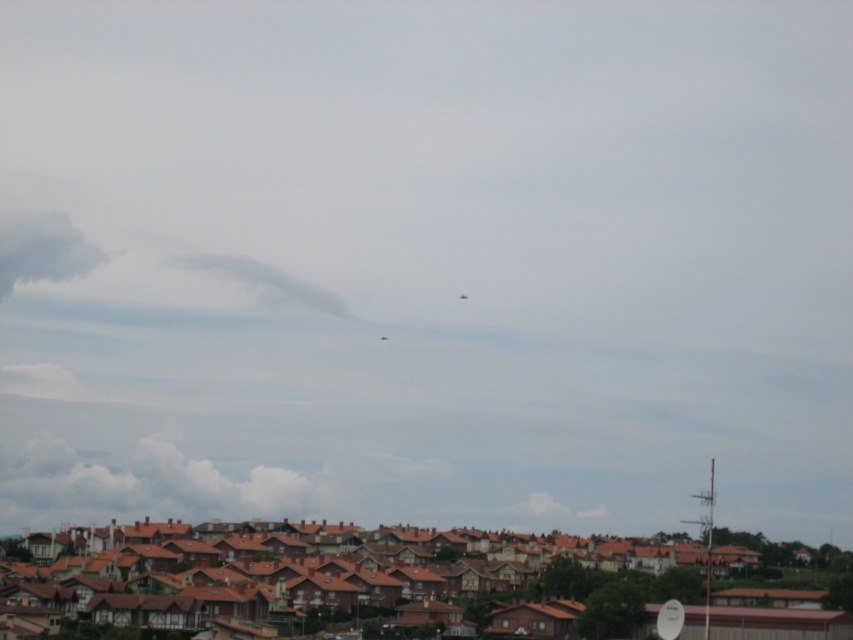
Is brown tiled roofs at lower center to the right of gray fluffy cloud at upper left from the viewer's perspective?

Yes, brown tiled roofs at lower center is to the right of gray fluffy cloud at upper left.

Consider the image. Between brown tiled roofs at lower center and gray fluffy cloud at upper left, which one appears on the right side from the viewer's perspective?

brown tiled roofs at lower center is more to the right.

Does point (48, 538) lie behind point (103, 259)?

That is False.

You are a GUI agent. You are given a task and a screenshot of the screen. Output one action in this format:
    pyautogui.click(x=<x>, y=<y>)
    Task: Click on the brown tiled roofs at lower center
    The width and height of the screenshot is (853, 640).
    Given the screenshot: What is the action you would take?
    pyautogui.click(x=451, y=564)

Is the position of brown tiled roofs at lower center more distant than that of white fluffy cloud at upper center?

No.

Which is in front, point (260, 541) or point (199, 257)?

Point (260, 541) is more forward.

You are a GUI agent. You are given a task and a screenshot of the screen. Output one action in this format:
    pyautogui.click(x=<x>, y=<y>)
    Task: Click on the brown tiled roofs at lower center
    Image resolution: width=853 pixels, height=640 pixels.
    Given the screenshot: What is the action you would take?
    pyautogui.click(x=451, y=564)

Is gray fluffy cloud at upper left below white fluffy cloud at upper center?

Incorrect, gray fluffy cloud at upper left is not positioned below white fluffy cloud at upper center.

Is gray fluffy cloud at upper left thinner than white fluffy cloud at upper center?

Yes.

Is point (33, 257) in front of point (302, 300)?

That is False.

Identify the location of gray fluffy cloud at upper left. The height and width of the screenshot is (640, 853). (42, 248).